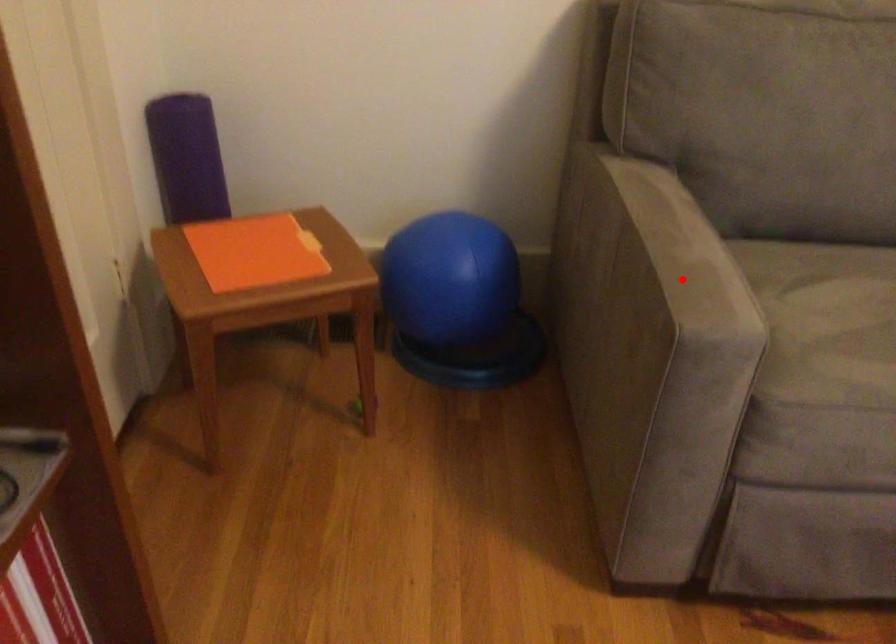
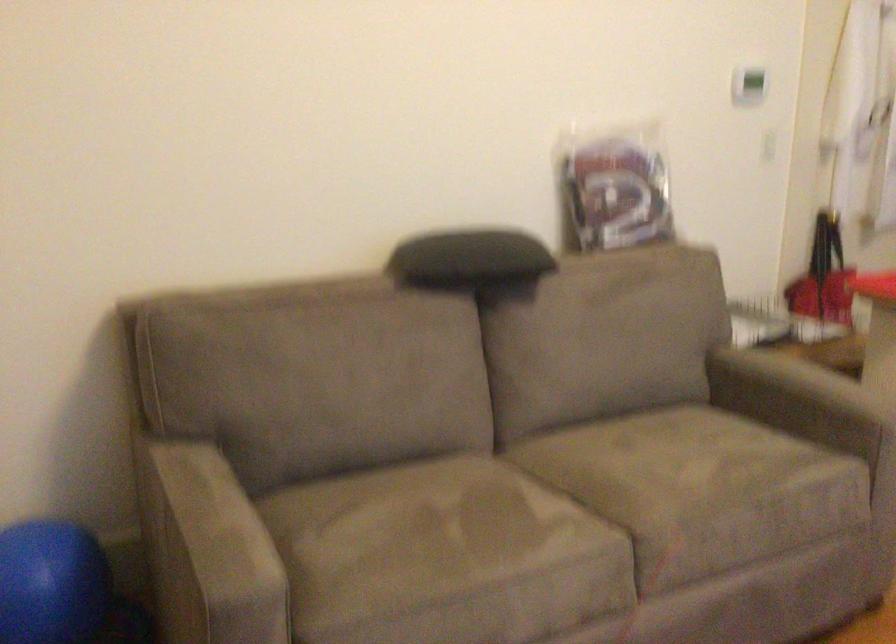
In the second image, find the point that corresponds to the highlighted location in the first image.

(209, 550)